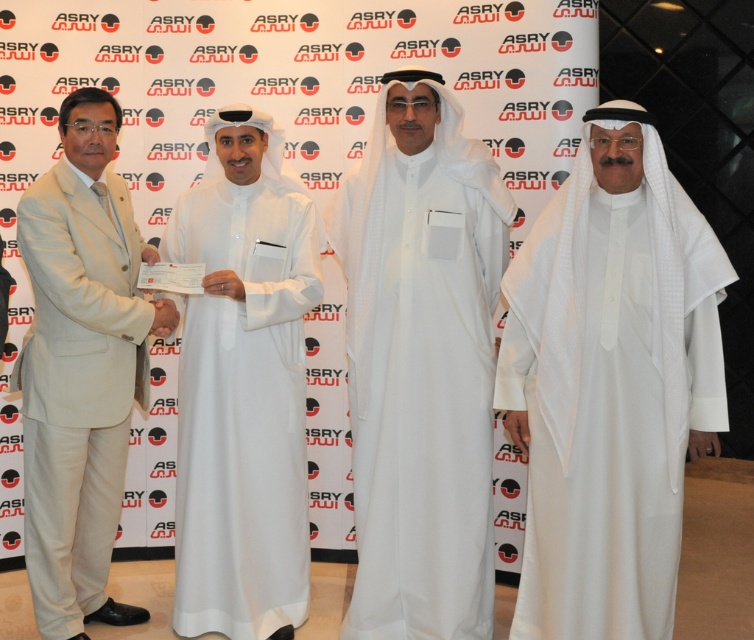
You are a photographer at the event and need to capture a clear shot of both the white cotton thobe at center and the white matte abaya at center. Since both are white, how can you distinguish them in the photo?

The white cotton thobe at center is positioned over the white matte abaya at center, so the thobe will appear in front of the abaya in the photo, making them distinguishable by their overlapping positions.

You are standing in front of the backdrop with the ASRY logo. You need to place a small sticker on the point that is closer to you. Which point should you choose between point (287,550) and point (51,612)?

Point (51,612) is closer to you than point (287,550), so you should place the sticker on point (51,612).

You are a photographer positioned in front of the ASRY backdrop. You need to take a photo where the white cotton thobe at center and the beige suit at left are both clearly visible. Which person should you focus on first to ensure the thobe at center is sharp?

The white cotton thobe at center is further to the viewer than the beige suit at left, so you should focus on the white cotton thobe at center first to ensure it is sharp before adjusting for the beige suit at left.